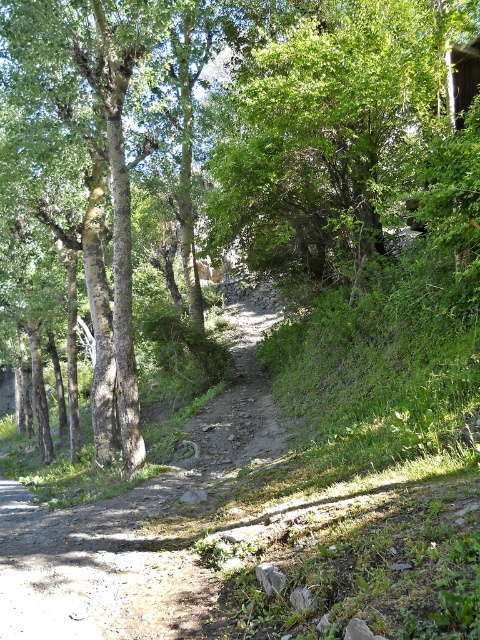
Who is positioned more to the left, green leafy tree at upper center or rough bark tree at left?

rough bark tree at left is more to the left.

I want to click on green leafy tree at upper center, so click(x=336, y=132).

Locate an element on the screen. The width and height of the screenshot is (480, 640). green leafy tree at upper center is located at coordinates (336, 132).

Between brown rough tree at center and rough bark tree at left, which one has less height?

rough bark tree at left

Measure the distance between brown rough tree at center and camera.

brown rough tree at center and camera are 8.53 meters apart.

You are a GUI agent. You are given a task and a screenshot of the screen. Output one action in this format:
    pyautogui.click(x=<x>, y=<y>)
    Task: Click on the brown rough tree at center
    The image size is (480, 640).
    Given the screenshot: What is the action you would take?
    pyautogui.click(x=241, y=129)

I want to click on brown rough tree at center, so click(x=241, y=129).

Can you confirm if brown rough tree at center is positioned below green leafy tree at upper center?

Correct, brown rough tree at center is located below green leafy tree at upper center.

Can you confirm if brown rough tree at center is smaller than green leafy tree at upper center?

Actually, brown rough tree at center might be larger than green leafy tree at upper center.

Is point (373, 244) behind point (240, 145)?

No, it is not.

Where is `brown rough tree at center`? The width and height of the screenshot is (480, 640). brown rough tree at center is located at coordinates (241, 129).